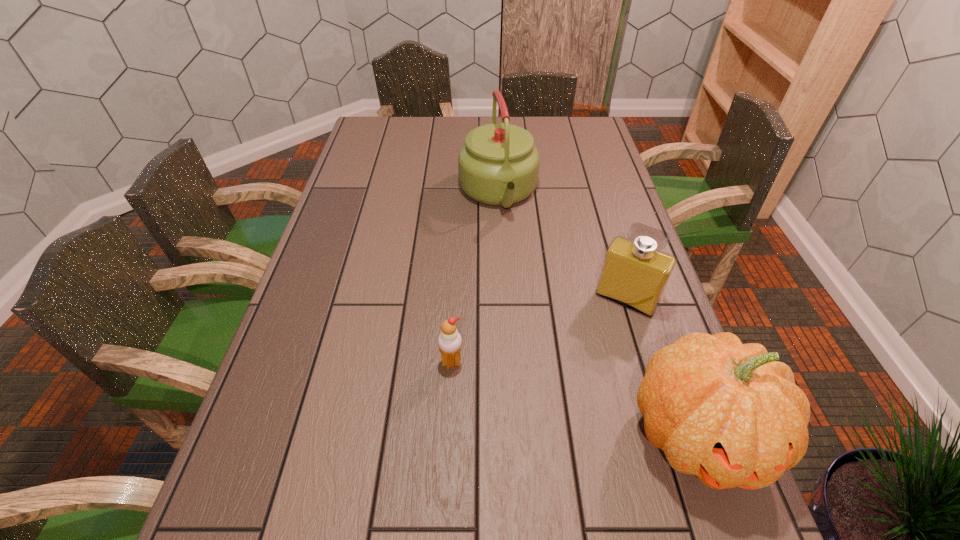
Find the location of a particular element. The width and height of the screenshot is (960, 540). free space on the desktop that is between the third farthest object and the pumpkin and is positioned on the front-facing side of the perfume is located at coordinates (572, 398).

Where is `free space on the desktop that is between the shortest object and the nearest object and is positioned at the spout of the farthest object`? free space on the desktop that is between the shortest object and the nearest object and is positioned at the spout of the farthest object is located at coordinates (557, 394).